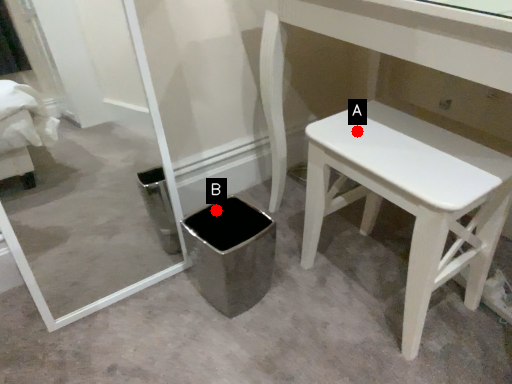
Question: Two points are circled on the image, labeled by A and B beside each circle. Which point appears closest to the camera in this image?

Choices:
 (A) A is closer
 (B) B is closer

Answer: (A)